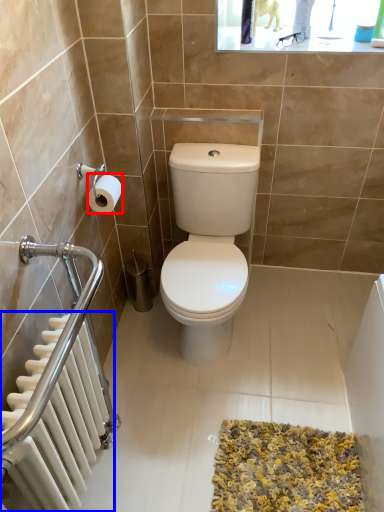
Question: Which point is further to the camera, toilet paper (highlighted by a red box) or radiator (highlighted by a blue box)?

Choices:
 (A) toilet paper
 (B) radiator

Answer: (A)